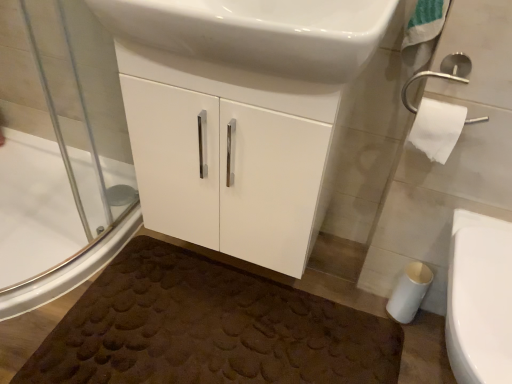
Identify the location of free space above brown textured bath mat at lower center (from a real-world perspective). Image resolution: width=512 pixels, height=384 pixels. (219, 329).